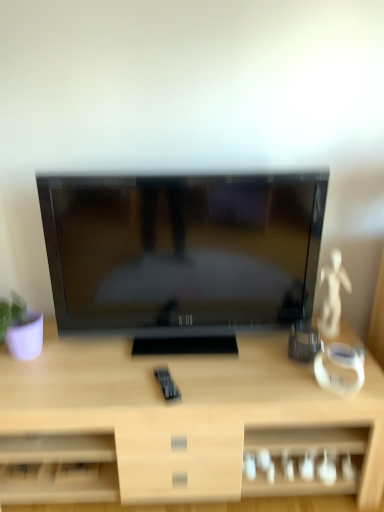
Question: Is light wood desk at center oriented away from matte black tv at center?

Choices:
 (A) no
 (B) yes

Answer: (A)

Question: Is the surface of light wood desk at center in direct contact with matte black tv at center?

Choices:
 (A) no
 (B) yes

Answer: (A)

Question: Is the position of light wood desk at center more distant than that of matte black tv at center?

Choices:
 (A) yes
 (B) no

Answer: (B)

Question: Is light wood desk at center to the right of matte black tv at center from the viewer's perspective?

Choices:
 (A) no
 (B) yes

Answer: (A)

Question: Can we say light wood desk at center lies outside matte black tv at center?

Choices:
 (A) no
 (B) yes

Answer: (B)

Question: From the image's perspective, does light wood desk at center appear higher than matte black tv at center?

Choices:
 (A) yes
 (B) no

Answer: (B)

Question: From a real-world perspective, does matte black tv at center stand above light wood desk at center?

Choices:
 (A) no
 (B) yes

Answer: (B)

Question: Is light wood desk at center a part of matte black tv at center?

Choices:
 (A) no
 (B) yes

Answer: (A)

Question: Does matte black tv at center come behind light wood desk at center?

Choices:
 (A) yes
 (B) no

Answer: (A)

Question: Can you confirm if matte black tv at center is shorter than light wood desk at center?

Choices:
 (A) no
 (B) yes

Answer: (A)

Question: Could you tell me if matte black tv at center is turned towards light wood desk at center?

Choices:
 (A) yes
 (B) no

Answer: (B)

Question: Is matte black tv at center looking in the opposite direction of light wood desk at center?

Choices:
 (A) no
 (B) yes

Answer: (A)

Question: In the image, is light wood desk at center on the left side or the right side of matte black tv at center?

Choices:
 (A) left
 (B) right

Answer: (A)